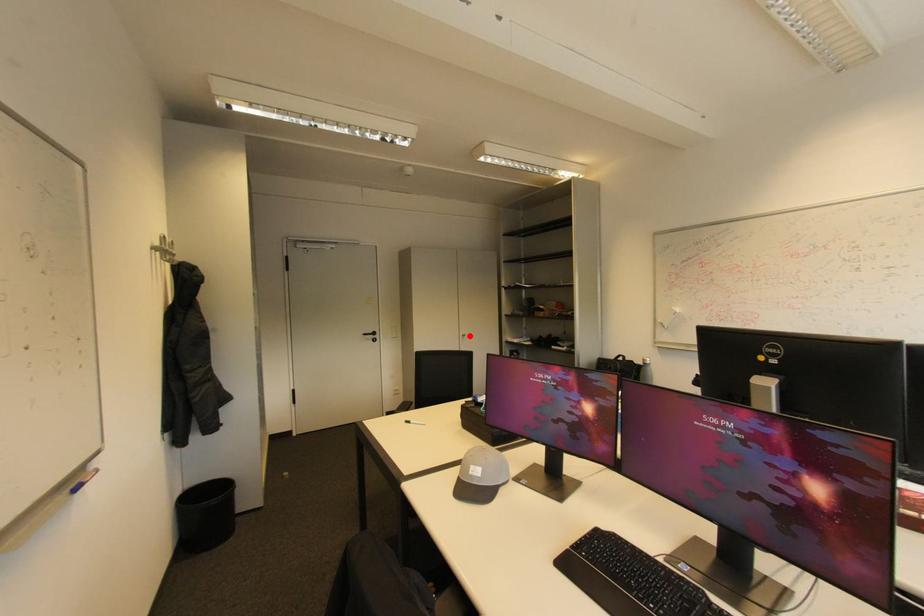
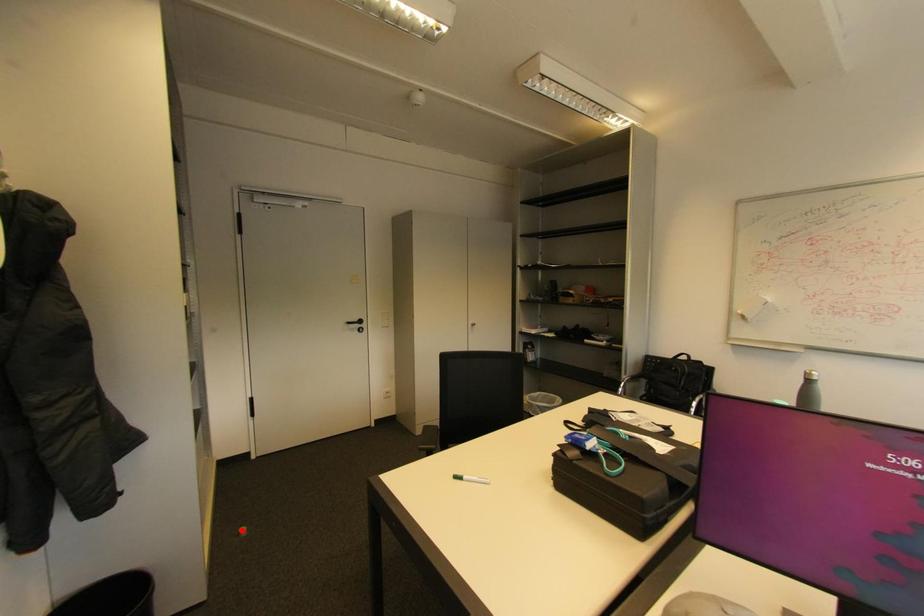
I am providing you with two images of the same scene from different viewpoints. A red point is marked on the first image and another point is marked on the second image. Does the point marked in image1 correspond to the same location as the one in image2?

No